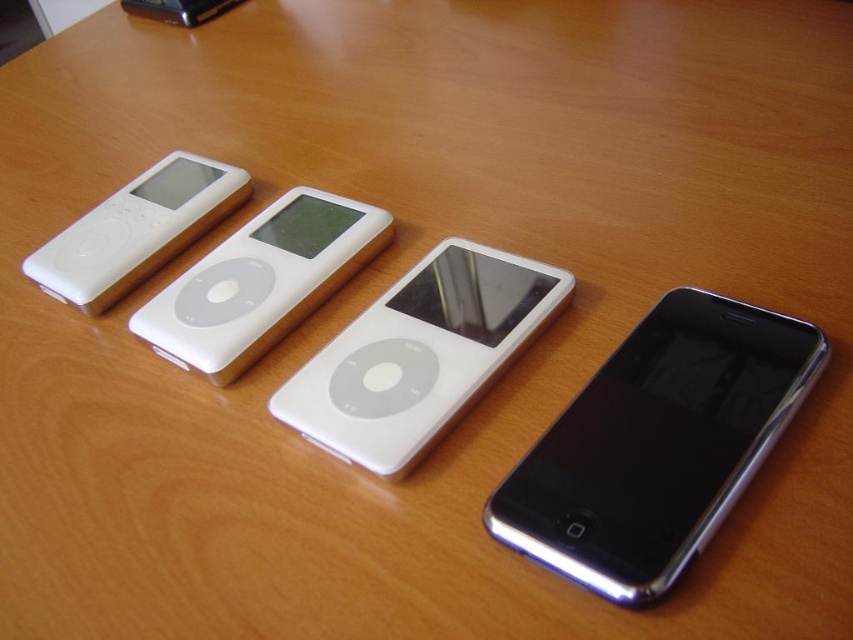
Question: Can you confirm if black glossy smartphone at lower right is smaller than white glossy ipod at center?

Choices:
 (A) yes
 (B) no

Answer: (A)

Question: Which point is farther to the camera?

Choices:
 (A) (328, 296)
 (B) (160, 237)
 (C) (631, 362)
 (D) (335, 362)

Answer: (B)

Question: Which of the following is the farthest from the observer?

Choices:
 (A) (604, 474)
 (B) (276, 304)
 (C) (300, 388)
 (D) (209, 161)

Answer: (D)

Question: Does sleek white ipod at center have a lesser width compared to white glossy ipod at left?

Choices:
 (A) no
 (B) yes

Answer: (B)

Question: Which object appears farthest from the camera in this image?

Choices:
 (A) sleek white ipod at center
 (B) white glossy ipod at center

Answer: (B)

Question: Where is black glossy smartphone at lower right located in relation to white glossy ipod at center in the image?

Choices:
 (A) left
 (B) right

Answer: (B)